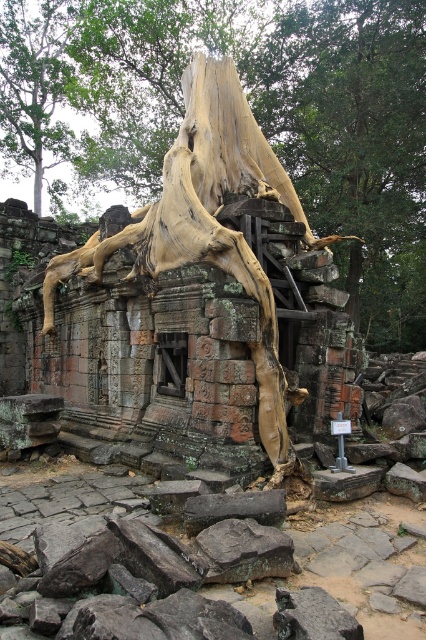
Question: Is the position of light brown bark tree trunk at center more distant than that of smooth gray rock at center?

Choices:
 (A) yes
 (B) no

Answer: (A)

Question: Observing the image, what is the correct spatial positioning of light brown bark tree trunk at center in reference to smooth gray rock at center?

Choices:
 (A) left
 (B) right

Answer: (A)

Question: Which of the following is the closest to the observer?

Choices:
 (A) (268, 42)
 (B) (227, 525)

Answer: (B)

Question: Can you confirm if light brown bark tree trunk at center is positioned below smooth gray rock at center?

Choices:
 (A) no
 (B) yes

Answer: (A)